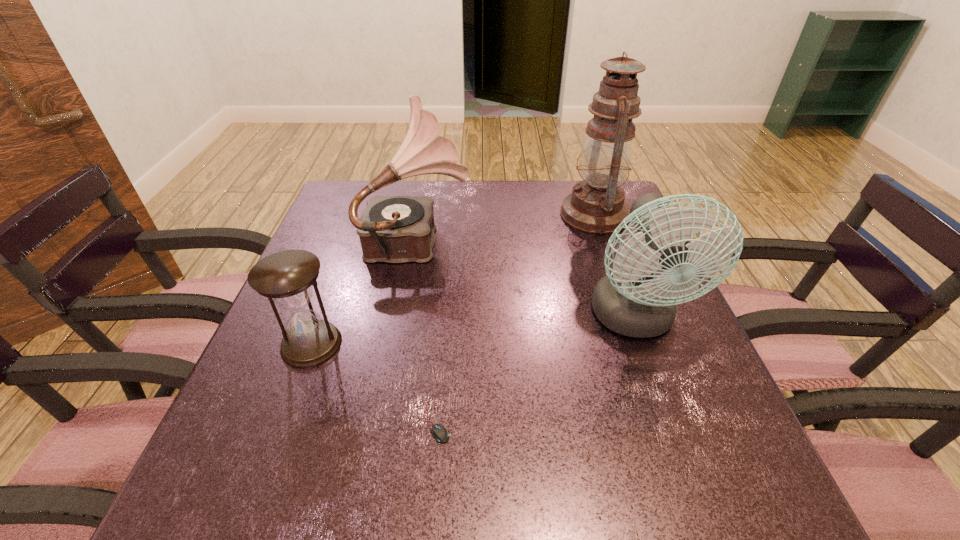
Image resolution: width=960 pixels, height=540 pixels. Identify the location of oil lamp. (596, 205).

The image size is (960, 540). In order to click on record player in this screenshot , I will do `click(396, 229)`.

Locate an element on the screen. fan is located at coordinates (631, 301).

Find the location of a particular element. the second shortest object is located at coordinates (286, 277).

The height and width of the screenshot is (540, 960). Find the location of `mouse`. mouse is located at coordinates (440, 434).

Locate an element on the screen. The height and width of the screenshot is (540, 960). the nearest object is located at coordinates (440, 434).

The image size is (960, 540). I want to click on free space located 0.170m on the left of the oil lamp, so click(x=498, y=214).

This screenshot has width=960, height=540. In order to click on vacant space situated from the horn of the record player in this screenshot , I will do `click(507, 239)`.

At what (x,y) coordinates should I click in order to perform the action: click on vacant space situated in front of the fan where the airflow is directed. Please return your answer as a coordinate pair (x, y). The image size is (960, 540). Looking at the image, I should click on (660, 393).

Image resolution: width=960 pixels, height=540 pixels. What are the coordinates of `blank space located on the front of the hourglass` in the screenshot? It's located at (280, 428).